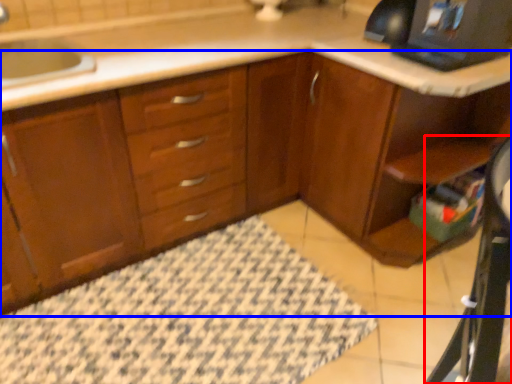
Question: Which object is further to the camera taking this photo, computer desk (highlighted by a red box) or cabinetry (highlighted by a blue box)?

Choices:
 (A) computer desk
 (B) cabinetry

Answer: (B)